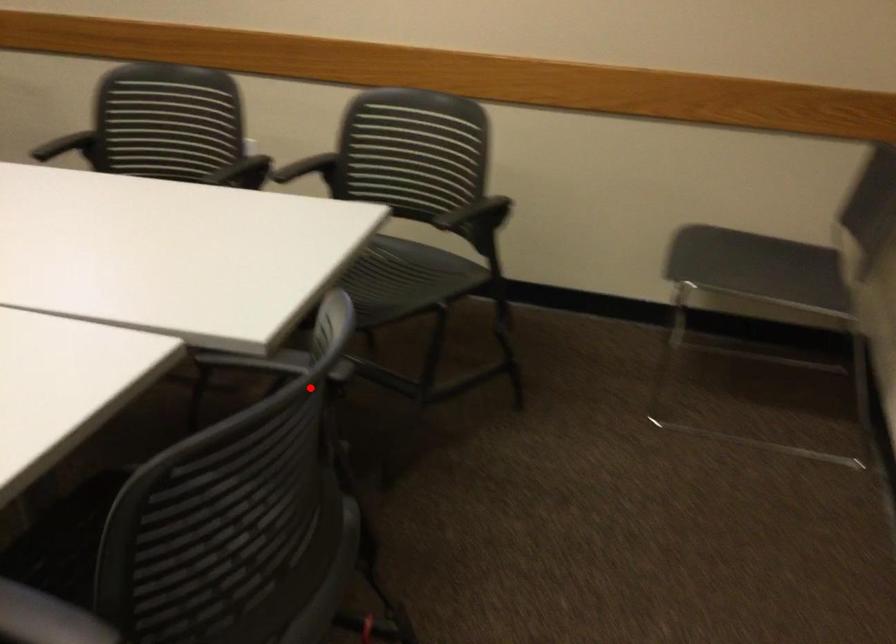
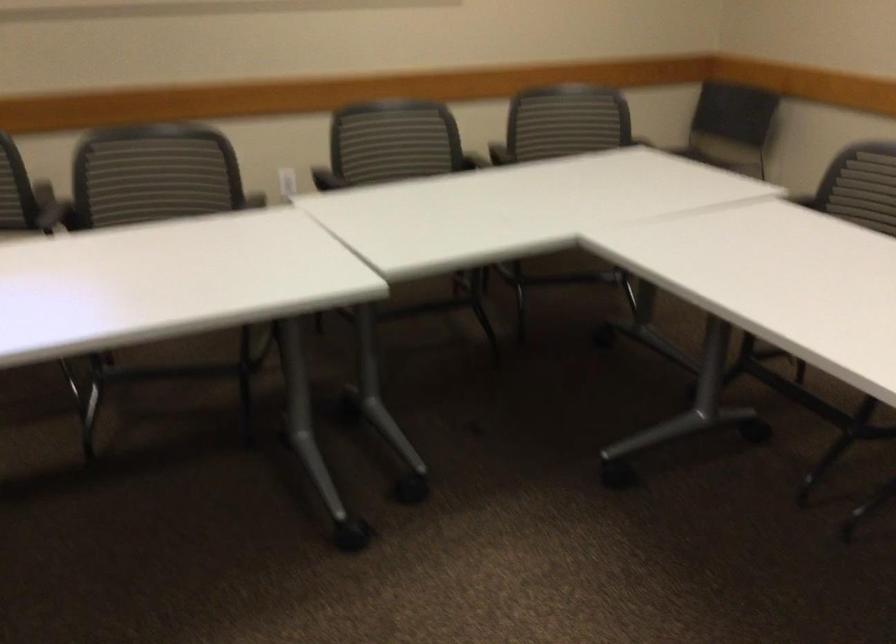
Question: I am providing you with two images of the same scene from different viewpoints. Given a red point in image1, look at the same physical point in image2. Is it:

Choices:
 (A) Closer to the viewpoint
 (B) Farther from the viewpoint

Answer: (B)